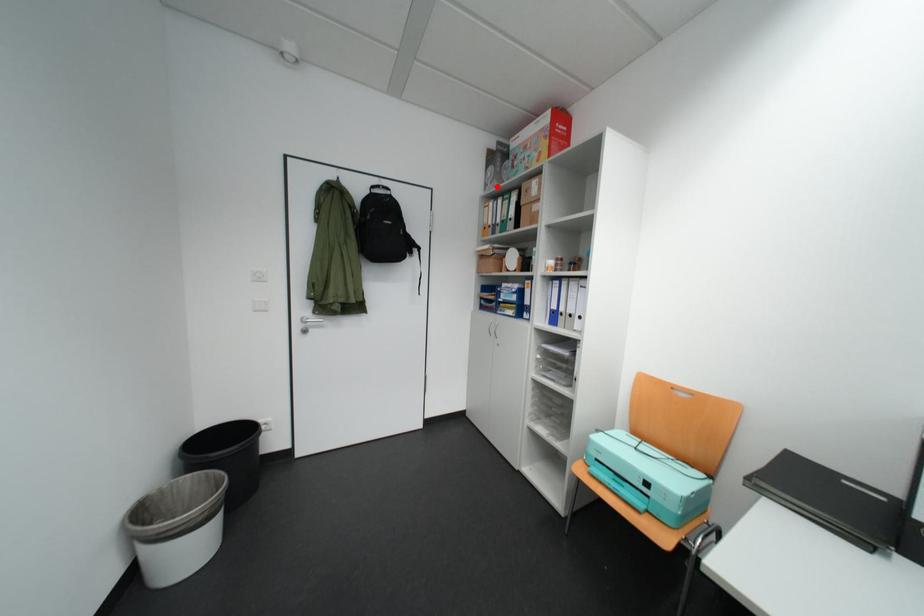
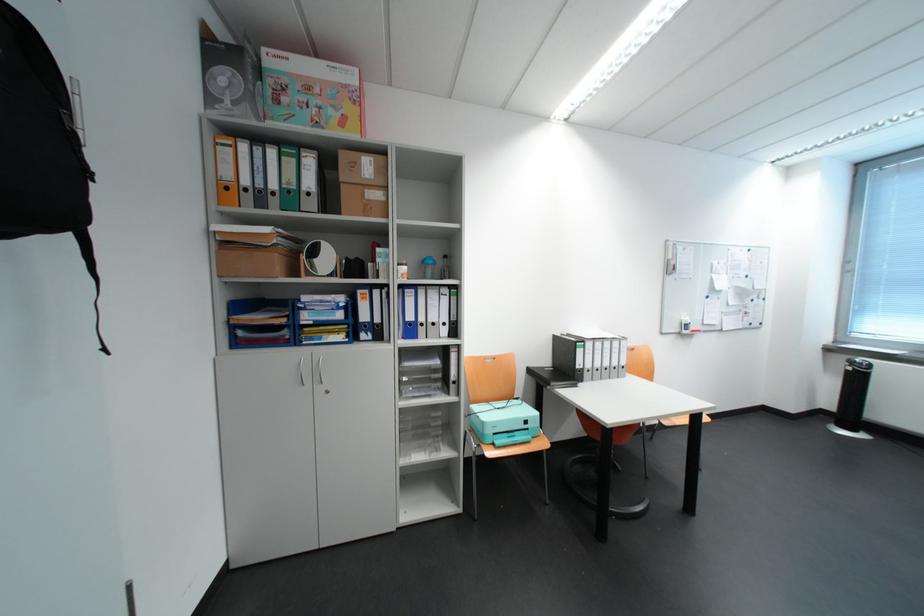
Question: I am providing you with two images of the same scene from different viewpoints. Image1 has a red point marked. In image2, the corresponding 3D location appears at what relative position? Reply with the corresponding letter.

Choices:
 (A) Closer
 (B) Farther

Answer: (B)